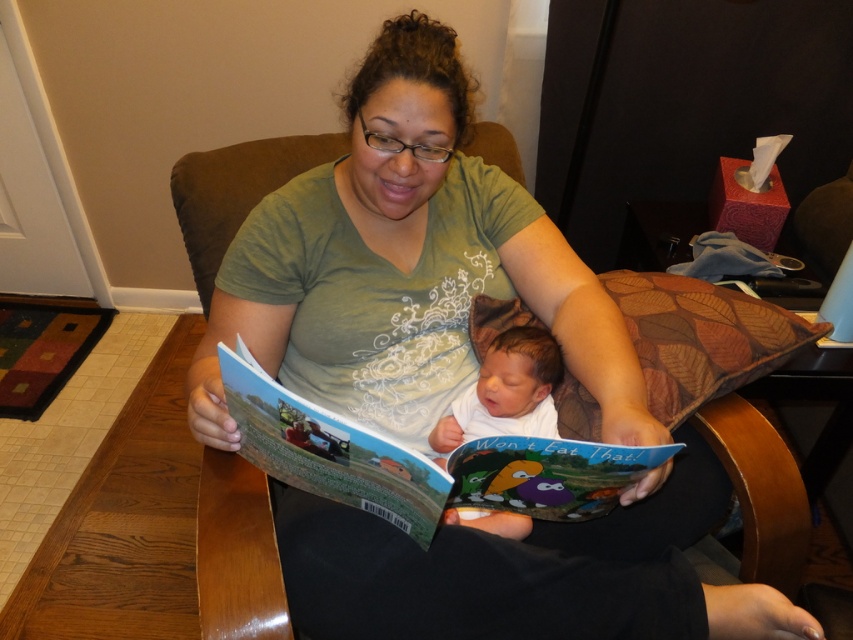
Identify the location of hardcover book at center. (421, 460).

Does hardcover book at center appear over soft white skin at center?

No, hardcover book at center is not above soft white skin at center.

The height and width of the screenshot is (640, 853). What do you see at coordinates (421, 460) in the screenshot?
I see `hardcover book at center` at bounding box center [421, 460].

What are the coordinates of `hardcover book at center` in the screenshot? It's located at (421, 460).

Does green matte shirt at center have a greater width compared to soft white skin at center?

Yes.

Looking at this image, does green matte shirt at center have a larger size compared to soft white skin at center?

Yes, green matte shirt at center is bigger than soft white skin at center.

Consider the image. Who is more forward, (772, 625) or (485, 387)?

Point (772, 625)

This screenshot has height=640, width=853. What are the coordinates of `green matte shirt at center` in the screenshot? It's located at [x=451, y=381].

Can you confirm if green matte shirt at center is smaller than hardcover book at center?

Incorrect, green matte shirt at center is not smaller in size than hardcover book at center.

Identify the location of green matte shirt at center. (451, 381).

Is point (434, 296) farther from camera compared to point (514, 483)?

Yes, it is.

I want to click on green matte shirt at center, so click(x=451, y=381).